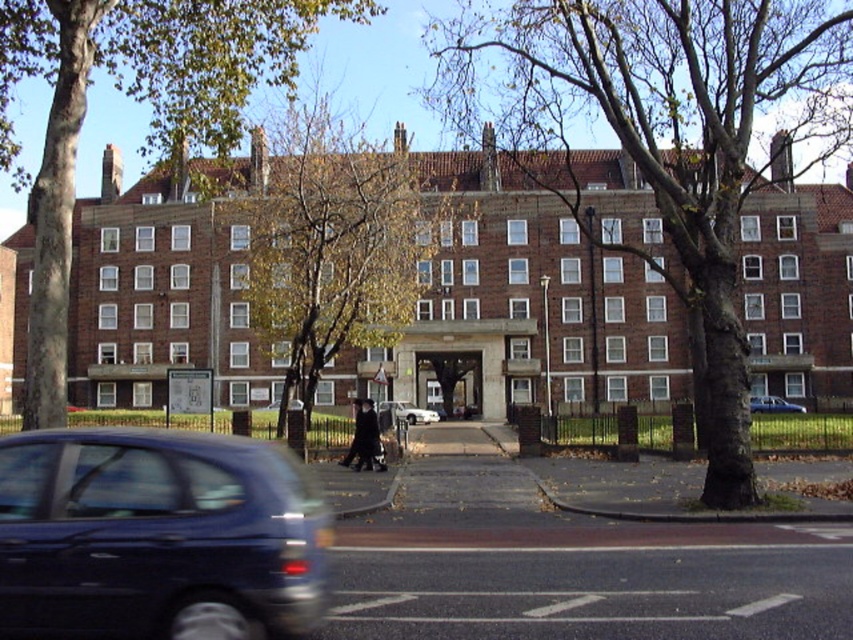
Does point (48, 56) come in front of point (766, 404)?

Yes, it is in front of point (766, 404).

This screenshot has height=640, width=853. Describe the element at coordinates (137, 100) in the screenshot. I see `green leafy tree at left` at that location.

Find the location of a particular element. The image size is (853, 640). green leafy tree at left is located at coordinates (137, 100).

Between green leafy tree at center and blue metallic car at center, which one appears on the left side from the viewer's perspective?

green leafy tree at center

Between green leafy tree at center and blue metallic car at center, which one has less height?

blue metallic car at center

Measure the distance between green leafy tree at center and camera.

A distance of 38.64 meters exists between green leafy tree at center and camera.

Locate an element on the screen. The height and width of the screenshot is (640, 853). green leafy tree at center is located at coordinates (335, 244).

How far apart are smooth bark tree at center and green leafy tree at left?

smooth bark tree at center is 22.07 meters away from green leafy tree at left.

Can you confirm if smooth bark tree at center is bigger than green leafy tree at left?

Yes.

Who is more forward, [465,100] or [44,8]?

Point [44,8]

The height and width of the screenshot is (640, 853). I want to click on smooth bark tree at center, so click(672, 140).